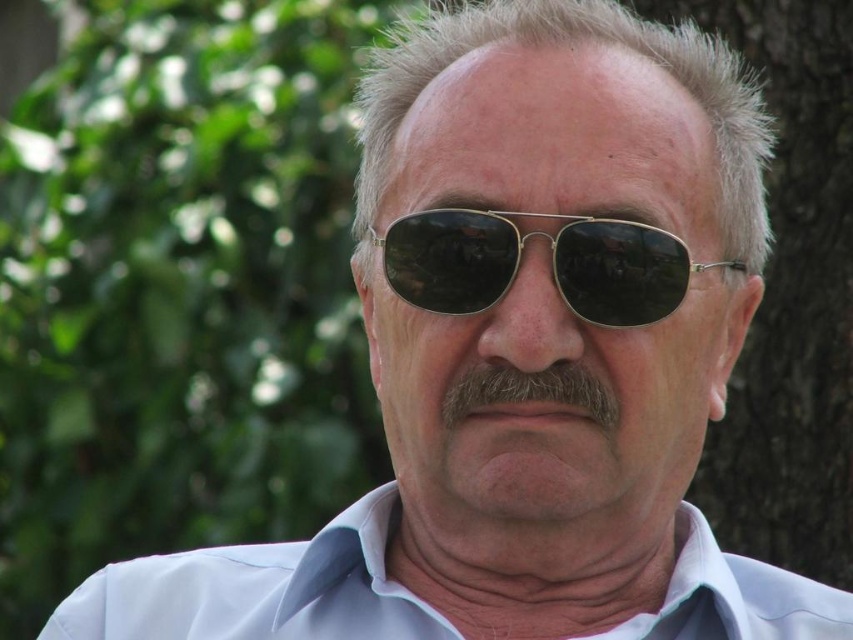
Is gold metallic aviator sunglasses at center behind gray fuzzy beard at center?

Yes, it is.

Image resolution: width=853 pixels, height=640 pixels. Find the location of `gold metallic aviator sunglasses at center`. gold metallic aviator sunglasses at center is located at coordinates (550, 264).

Describe the element at coordinates (550, 264) in the screenshot. I see `gold metallic aviator sunglasses at center` at that location.

This screenshot has height=640, width=853. What do you see at coordinates (550, 264) in the screenshot? I see `gold metallic aviator sunglasses at center` at bounding box center [550, 264].

At what (x,y) coordinates should I click in order to perform the action: click on gold metallic aviator sunglasses at center. Please return your answer as a coordinate pair (x, y). This screenshot has width=853, height=640. Looking at the image, I should click on (550, 264).

Does gray matte hair at center have a greater width compared to gray/soft hair at center?

Yes.

Is gray matte hair at center shorter than gray/soft hair at center?

In fact, gray matte hair at center may be taller than gray/soft hair at center.

Is point (514, 12) in front of point (509, 483)?

No, (514, 12) is further to viewer.

This screenshot has height=640, width=853. Find the location of `gray matte hair at center`. gray matte hair at center is located at coordinates (573, 42).